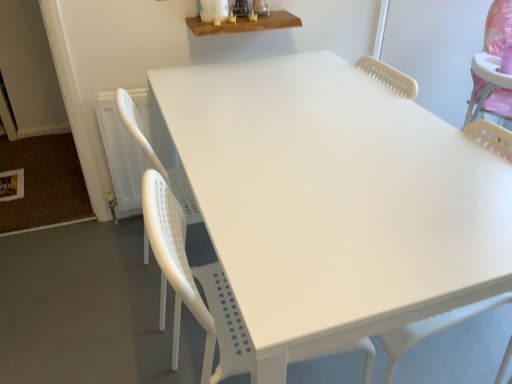
Question: Visually, is white plastic chair at center positioned to the left or to the right of white plastic table at center, the 1th table ordered from the bottom?

Choices:
 (A) right
 (B) left

Answer: (A)

Question: Does point (177, 331) appear closer or farther from the camera than point (294, 336)?

Choices:
 (A) closer
 (B) farther

Answer: (B)

Question: Which object is positioned closest to the white plastic chair at center?

Choices:
 (A) white plastic swivel chair at center
 (B) wooden shelf at upper center, arranged as the 2th table when ordered from the bottom
 (C) white plastic table at center, the second table in the top-to-bottom sequence

Answer: (C)

Question: Considering the real-world distances, which object is closest to the white plastic swivel chair at center?

Choices:
 (A) white plastic table at center, the second table in the top-to-bottom sequence
 (B) wooden shelf at upper center, positioned as the first table in top-to-bottom order
 (C) white plastic chair at center

Answer: (C)